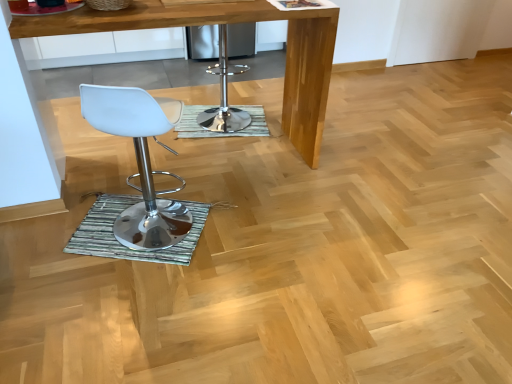
Question: In terms of width, does green textured mat at center, the second mat positioned from the front, look wider or thinner when compared to white plastic stool at left?

Choices:
 (A) thin
 (B) wide

Answer: (B)

Question: From a real-world perspective, relative to white plastic stool at left, is green textured mat at center, the second mat positioned from the front, vertically above or below?

Choices:
 (A) below
 (B) above

Answer: (A)

Question: Considering the real-world distances, which object is closest to the green textured mat at center, arranged as the first mat when viewed from the front?

Choices:
 (A) green textured mat at center, which is the second mat from bottom to top
 (B) white plastic stool at left
 (C) polished chrome bar stool at center
 (D) wooden table at center

Answer: (B)

Question: Which is farther from the wooden table at center?

Choices:
 (A) green textured mat at center, which is counted as the first mat, starting from the bottom
 (B) polished chrome bar stool at center
 (C) green textured mat at center, the 1th mat when ordered from top to bottom
 (D) white plastic stool at left

Answer: (A)